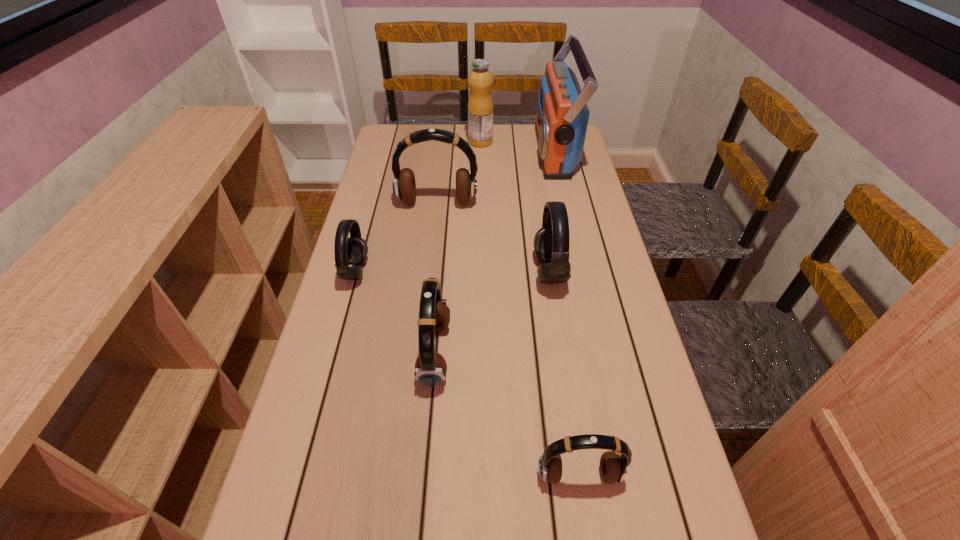
At what (x,y) coordinates should I click in order to perform the action: click on free region located 0.340m on the earcups of the right gray headset. Please return your answer as a coordinate pair (x, y). The width and height of the screenshot is (960, 540). Looking at the image, I should click on (406, 272).

This screenshot has height=540, width=960. I want to click on free spot located on the ear cup of the second farthest brown headset, so click(x=596, y=354).

The height and width of the screenshot is (540, 960). In order to click on free region located on the earcups of the leftmost object in this screenshot , I will do `click(408, 271)`.

The height and width of the screenshot is (540, 960). What are the coordinates of `vacant space located 0.060m on the ear cup of the smallest brown headset` in the screenshot? It's located at (587, 526).

The width and height of the screenshot is (960, 540). In order to click on radio receiver positioned at the far edge in this screenshot , I will do `click(562, 117)`.

Locate an element on the screen. fruit juice situated at the far edge is located at coordinates (480, 80).

This screenshot has height=540, width=960. In order to click on radio receiver that is positioned at the right edge in this screenshot , I will do `click(562, 117)`.

Find the location of a particular element. The height and width of the screenshot is (540, 960). object that is at the far right corner is located at coordinates (562, 117).

Locate an element on the screen. This screenshot has height=540, width=960. free region at the far edge of the desktop is located at coordinates (468, 127).

In the image, there is a desktop. At what (x,y) coordinates should I click in order to perform the action: click on vacant space at the left edge. Please return your answer as a coordinate pair (x, y). The image size is (960, 540). Looking at the image, I should click on pyautogui.click(x=337, y=499).